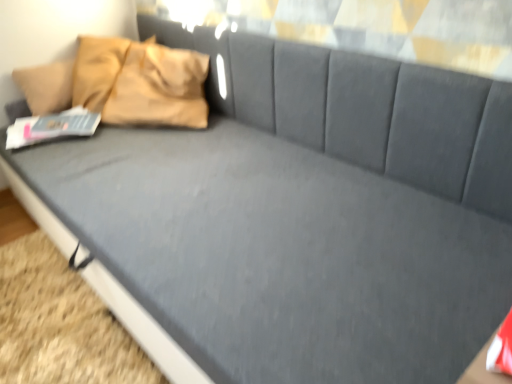
Identify the location of vacant area on top of white paper at left (from a real-world perspective). The image size is (512, 384). (54, 121).